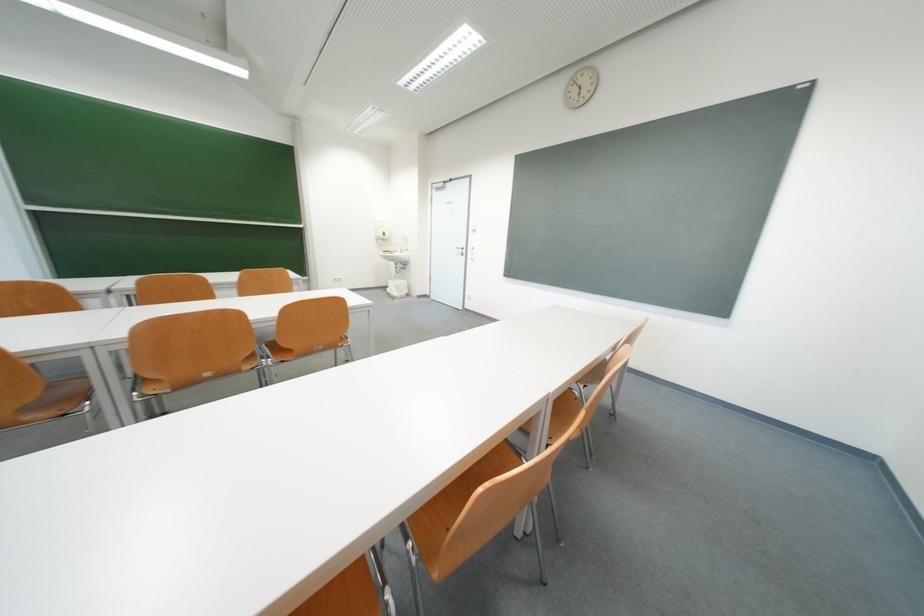
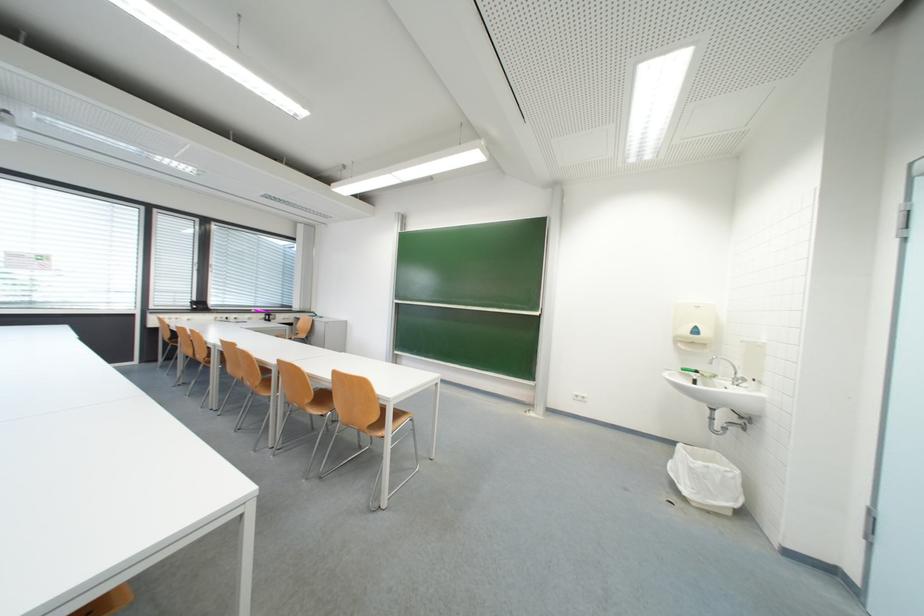
In the second image, find the point that corresponds to point 404,296 in the first image.

(695, 493)